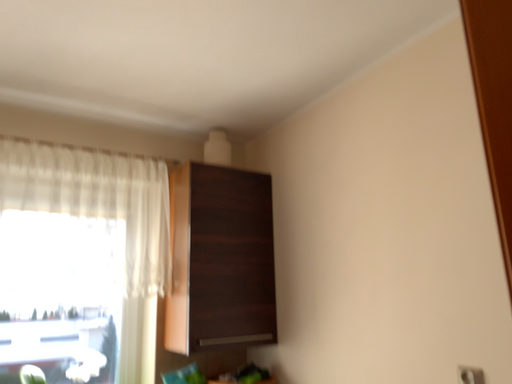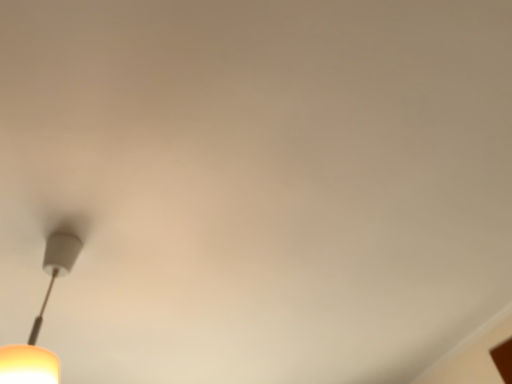
Question: How did the camera likely rotate when shooting the video?

Choices:
 (A) rotated upward
 (B) rotated downward

Answer: (A)